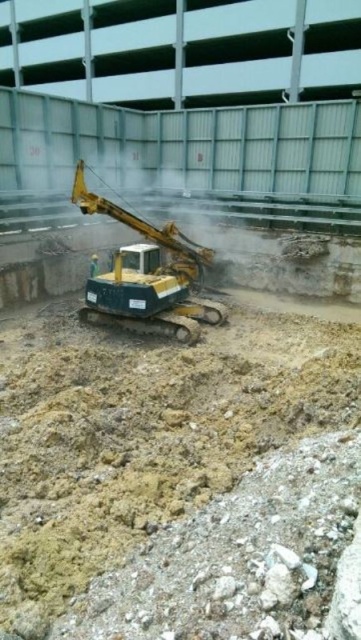
At what (x,y) coordinates should I click in order to perform the action: click on brown sandy dirt at center. Please return your answer as a coordinate pair (x, y). Looking at the image, I should click on (145, 432).

Between brown sandy dirt at center and yellow-green metal excavator at center, which one has more height?

brown sandy dirt at center is taller.

Locate an element on the screen. This screenshot has height=640, width=361. brown sandy dirt at center is located at coordinates (145, 432).